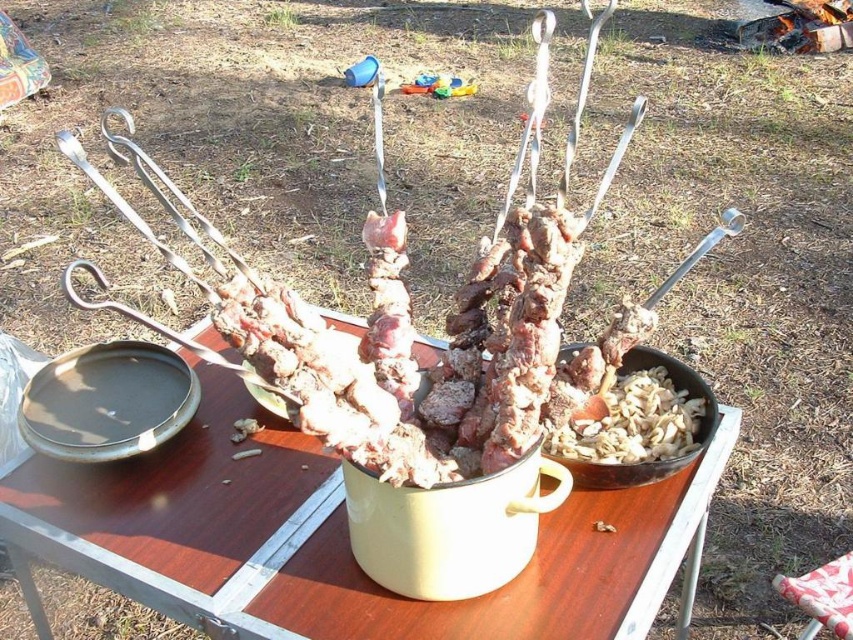
You are standing at the edge of the scene and want to place a plate of food on the white glossy table at center and the plastic red stool at lower right. Which object is closer to you?

The plastic red stool at lower right is closer to you because it is positioned to the right of the white glossy table at center, which is further away.

You are standing 5 feet away from the white glossy table at center. Can you reach the table without moving your feet?

The white glossy table at center is 33.50 inches from camera. Since 5 feet equals 60 inches, you are standing further away than the table, so you cannot reach it without moving closer.

You are standing at the edge of the wooden table looking towards the yellow pot with skewers. There are two points marked on the table surface. Which point is closer to you, point (688, 625) or point (834, 563)?

Point (834, 563) is closer to you because it is in front of point (688, 625).